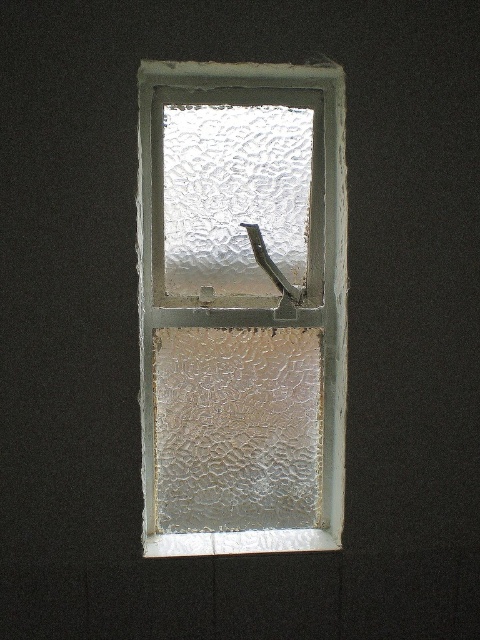
Is white textured frame at center further to the viewer compared to frosted glass at center?

That is False.

Between white textured frame at center and frosted glass at center, which one appears on the right side from the viewer's perspective?

white textured frame at center is more to the right.

Locate an element on the screen. This screenshot has height=640, width=480. white textured frame at center is located at coordinates point(241,307).